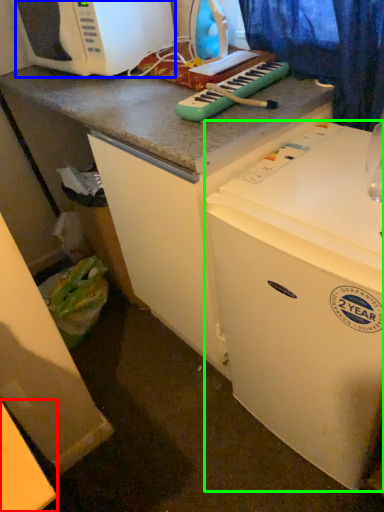
Question: Which object is the farthest from counter top (highlighted by a red box)? Choose among these: microwave oven (highlighted by a blue box) or refrigerator (highlighted by a green box).

Choices:
 (A) microwave oven
 (B) refrigerator

Answer: (A)